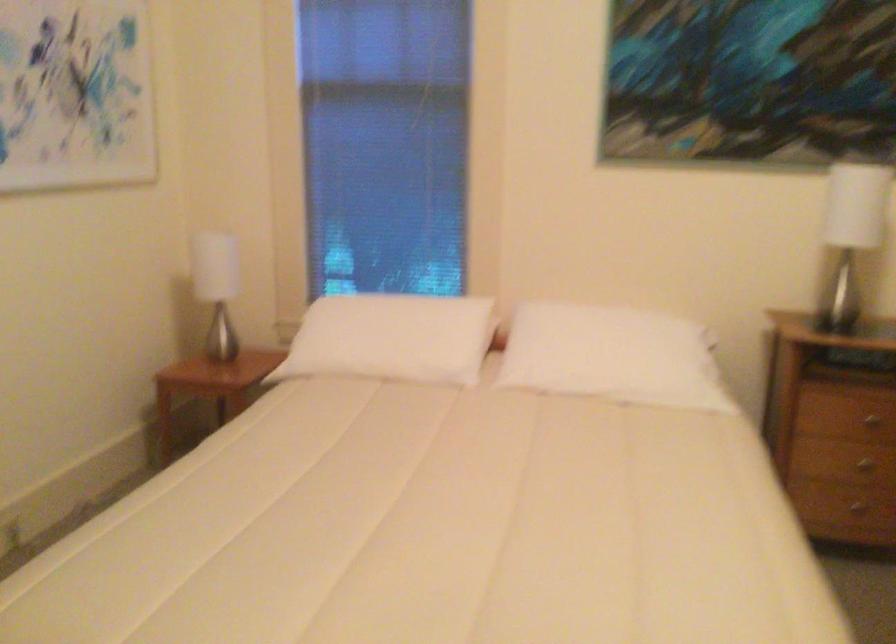
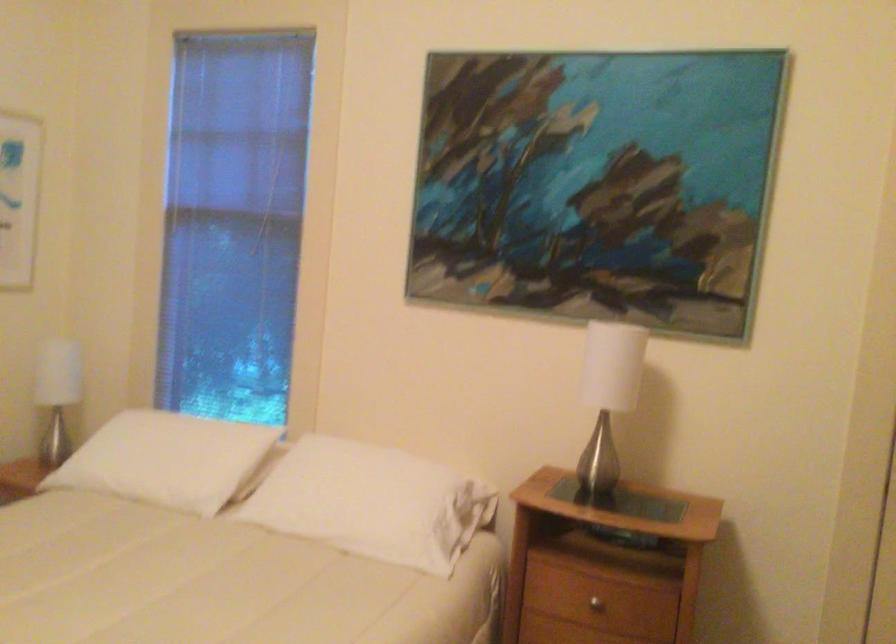
Find the pixel in the second image that matches (412,341) in the first image.

(167, 459)